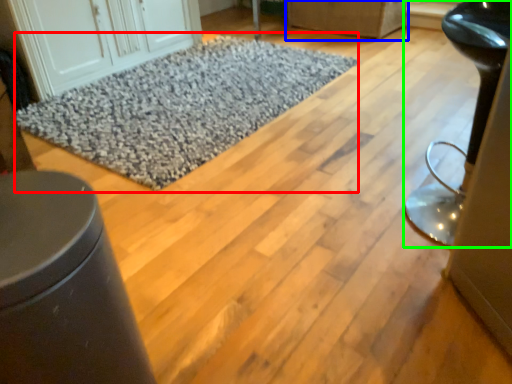
Question: Estimate the real-world distances between objects in this image. Which object is closer to mat (highlighted by a red box), furniture (highlighted by a blue box) or furniture (highlighted by a green box)?

Choices:
 (A) furniture
 (B) furniture

Answer: (A)